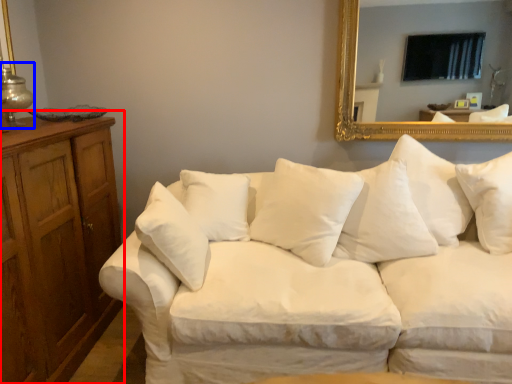
Question: Which object is closer to the camera taking this photo, dresser (highlighted by a red box) or table lamp (highlighted by a blue box)?

Choices:
 (A) dresser
 (B) table lamp

Answer: (A)